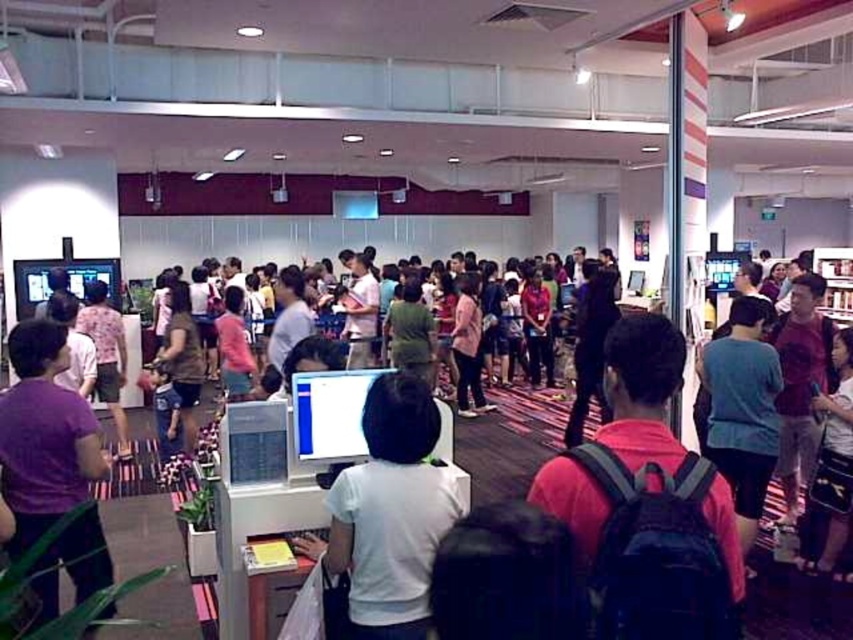
Question: Based on their relative distances, which object is farther from the white matte computer at center?

Choices:
 (A) matte pink shirt at center
 (B) dark gray fabric shirt at center-right
 (C) purple matte shirt at left

Answer: (A)

Question: Does red backpack at center appear over white matte computer at center?

Choices:
 (A) yes
 (B) no

Answer: (A)

Question: Is dark gray fabric shirt at center-right smaller than matte pink shirt at center?

Choices:
 (A) yes
 (B) no

Answer: (A)

Question: Is white matte computer at center above dark gray fabric shirt at center-right?

Choices:
 (A) yes
 (B) no

Answer: (A)

Question: Which point is farther to the camera?

Choices:
 (A) dark gray fabric shirt at center-right
 (B) purple matte shirt at left

Answer: (A)

Question: Which point is farther to the camera?

Choices:
 (A) (13, 548)
 (B) (733, 528)
 (C) (434, 436)
 (D) (729, 312)

Answer: (D)